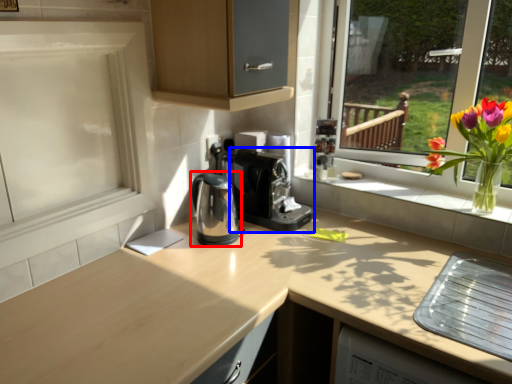
Question: Which of the following is the farthest to the observer, coffeepot (highlighted by a red box) or coffee machine (highlighted by a blue box)?

Choices:
 (A) coffeepot
 (B) coffee machine

Answer: (B)